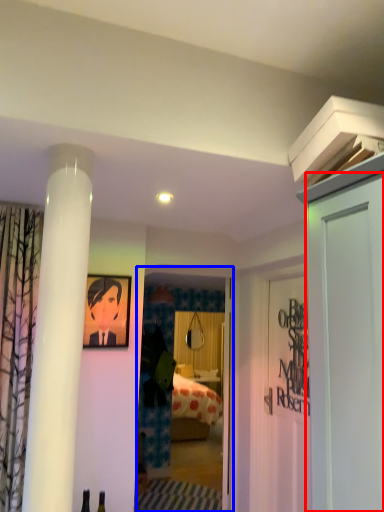
Question: Which object is closer to the camera taking this photo, door (highlighted by a red box) or glass door (highlighted by a blue box)?

Choices:
 (A) door
 (B) glass door

Answer: (A)